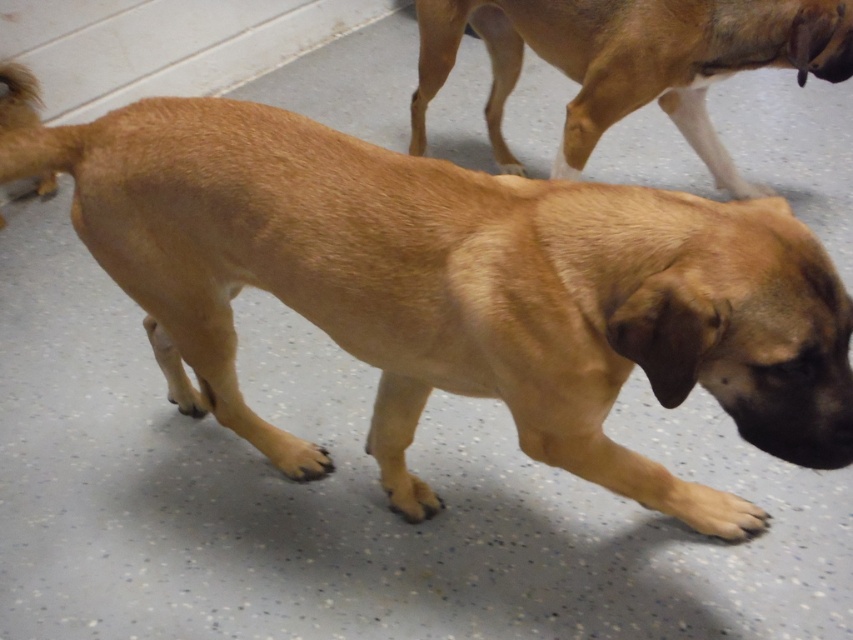
You are a dog trainer observing two dogs in a kennel. You see a brown fur dog at center and a brown furry dog at upper right. Which dog would cast a larger shadow if the light source is directly above them?

The brown fur dog at center is bigger than the brown furry dog at upper right, so it would cast a larger shadow.